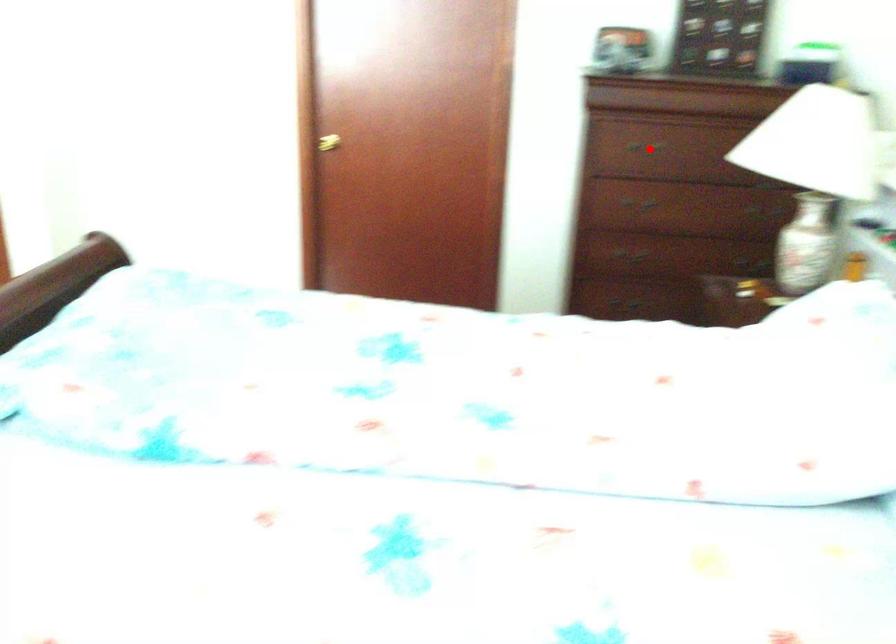
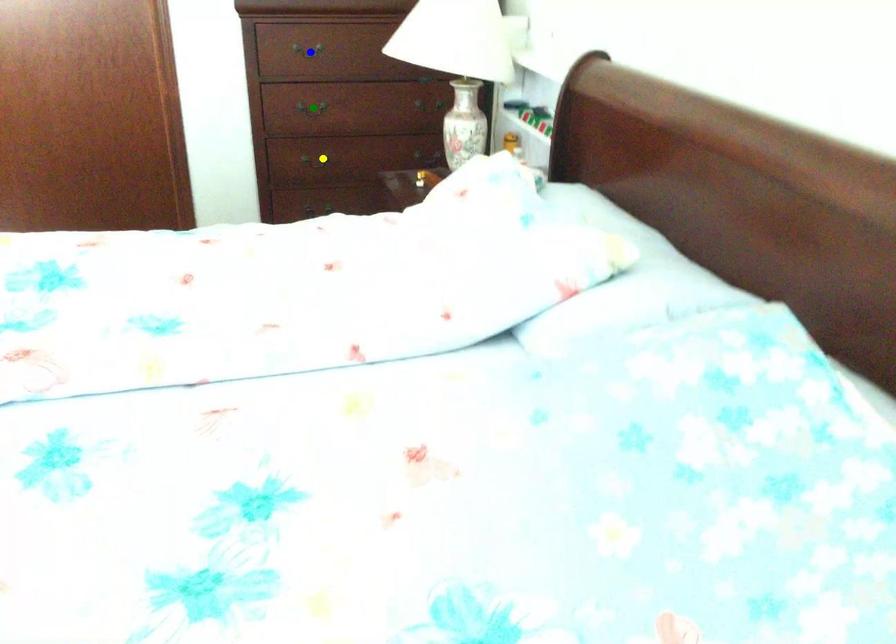
Question: I am providing you with two images of the same scene from different viewpoints. A red point is marked on the first image. You are given multiple points on the second image. Which spot in image 2 lines up with the point in image 1?

Choices:
 (A) blue point
 (B) green point
 (C) yellow point

Answer: (A)